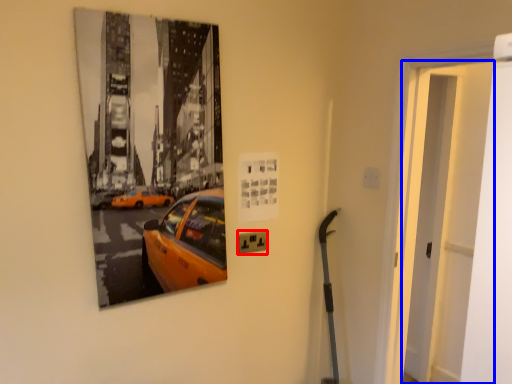
Question: Which point is closer to the camera, electric outlet (highlighted by a red box) or door (highlighted by a blue box)?

Choices:
 (A) electric outlet
 (B) door

Answer: (B)